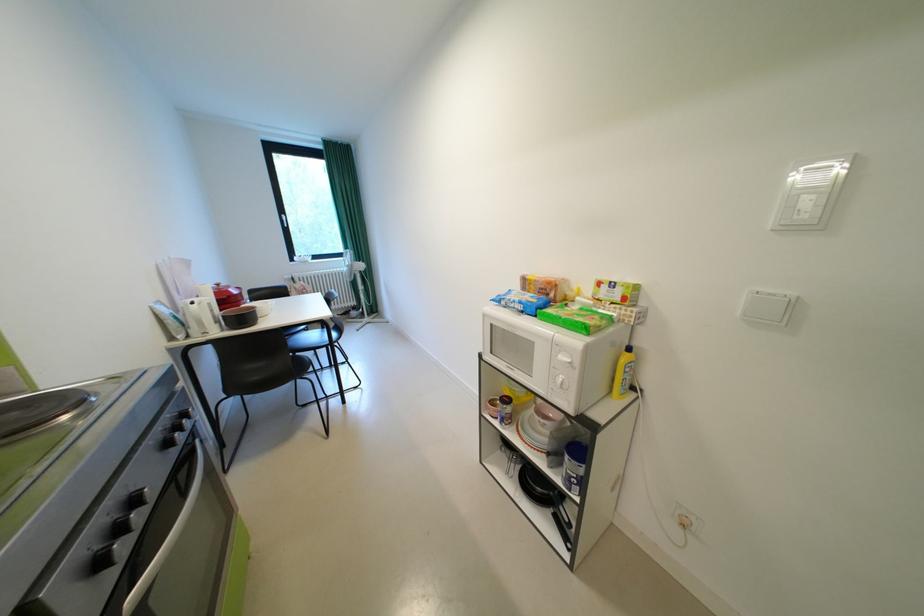
Locate an element on the screen. black chair sitting surface is located at coordinates (312, 339).